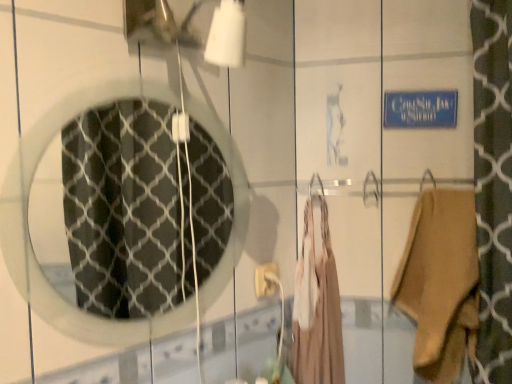
Question: From a real-world perspective, does tan suede boot at right, the second clothing viewed from the left, sit lower than beige fabric dress at center, which is the 2th clothing from right to left?

Choices:
 (A) yes
 (B) no

Answer: (B)

Question: Is tan suede boot at right, the second clothing viewed from the left, positioned before beige fabric dress at center, the 1th clothing when ordered from left to right?

Choices:
 (A) no
 (B) yes

Answer: (B)

Question: Is beige fabric dress at center, the 1th clothing when ordered from left to right, at the back of tan suede boot at right, the second clothing viewed from the left?

Choices:
 (A) no
 (B) yes

Answer: (A)

Question: Could you tell me if tan suede boot at right, the 1th clothing viewed from the right, is facing beige fabric dress at center, the 1th clothing when ordered from left to right?

Choices:
 (A) no
 (B) yes

Answer: (A)

Question: Is tan suede boot at right, the second clothing viewed from the left, to the right of beige fabric dress at center, which is the 2th clothing from right to left, from the viewer's perspective?

Choices:
 (A) no
 (B) yes

Answer: (B)

Question: Is beige fabric dress at center, which is the 2th clothing from right to left, behind clear glass mirror at center?

Choices:
 (A) no
 (B) yes

Answer: (B)

Question: Can you confirm if beige fabric dress at center, which is the 2th clothing from right to left, is taller than clear glass mirror at center?

Choices:
 (A) no
 (B) yes

Answer: (B)

Question: Considering the relative sizes of beige fabric dress at center, which is the 2th clothing from right to left, and clear glass mirror at center in the image provided, is beige fabric dress at center, which is the 2th clothing from right to left, bigger than clear glass mirror at center?

Choices:
 (A) no
 (B) yes

Answer: (B)

Question: Is beige fabric dress at center, the 1th clothing when ordered from left to right, at the left side of clear glass mirror at center?

Choices:
 (A) yes
 (B) no

Answer: (B)

Question: Is beige fabric dress at center, the 1th clothing when ordered from left to right, located outside clear glass mirror at center?

Choices:
 (A) no
 (B) yes

Answer: (B)

Question: Is beige fabric dress at center, which is the 2th clothing from right to left, positioned in front of clear glass mirror at center?

Choices:
 (A) no
 (B) yes

Answer: (A)

Question: Is white plastic electric outlet at center further to camera compared to tan suede boot at right, the second clothing viewed from the left?

Choices:
 (A) yes
 (B) no

Answer: (A)